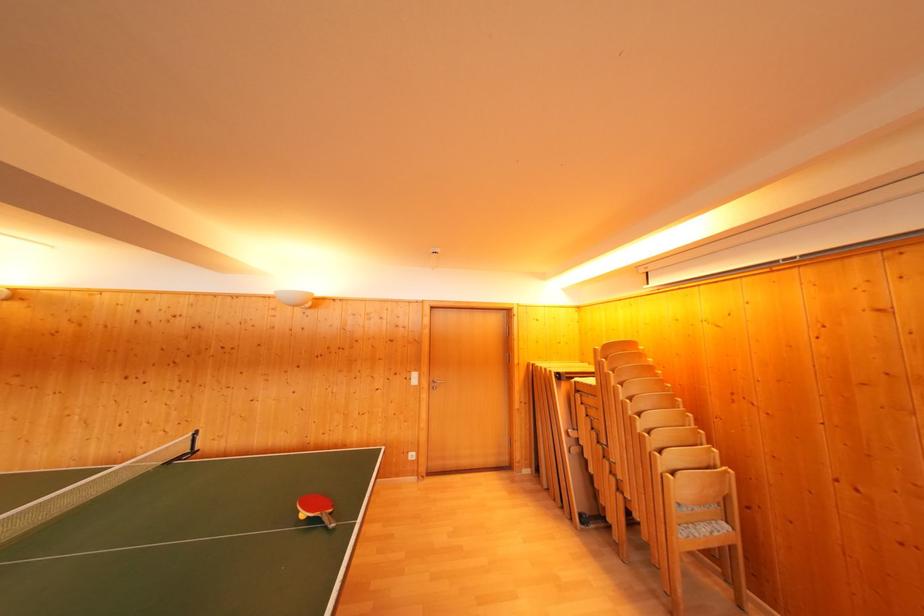
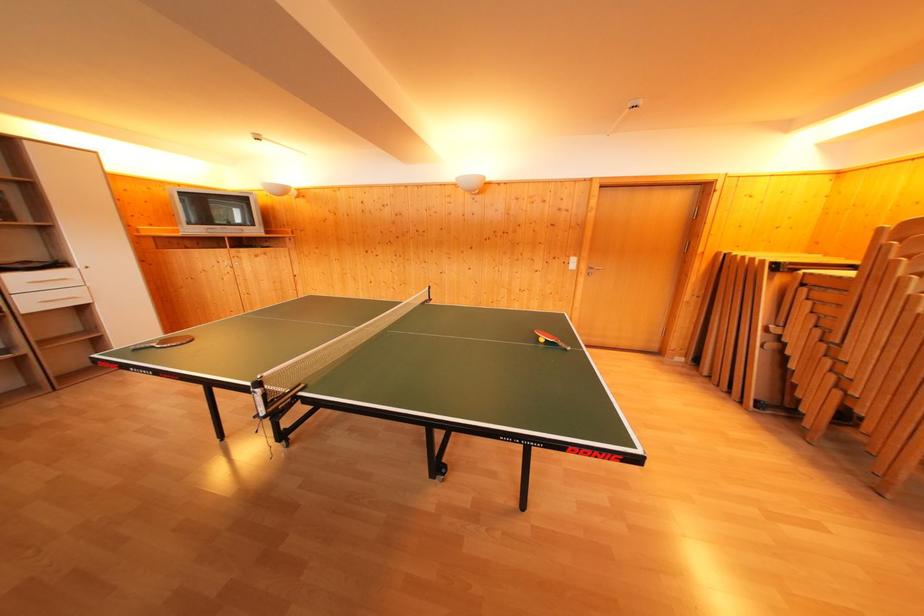
How did the camera likely rotate?

The camera's rotation is toward left-down.